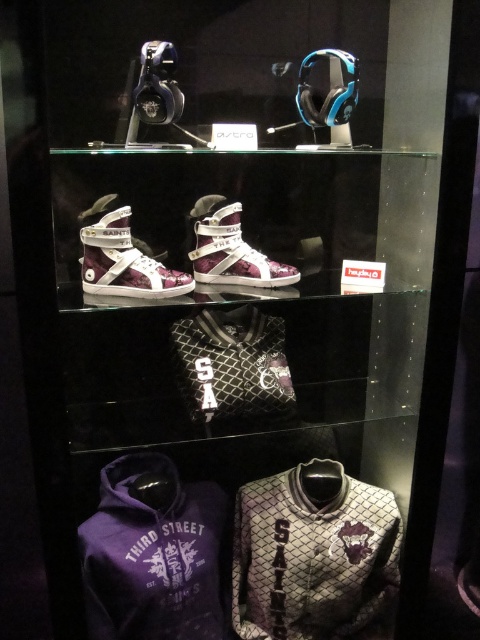
You are a store employee who needs to place a new item that is 24 inches wide between the gray textured sweatshirt at center and the matte purple fabric sneaker at center. Can you fit it without moving either item?

The distance between the gray textured sweatshirt at center and the matte purple fabric sneaker at center is 26.71 inches. Since the new item is 24 inches wide, it can fit between them as there is enough space.